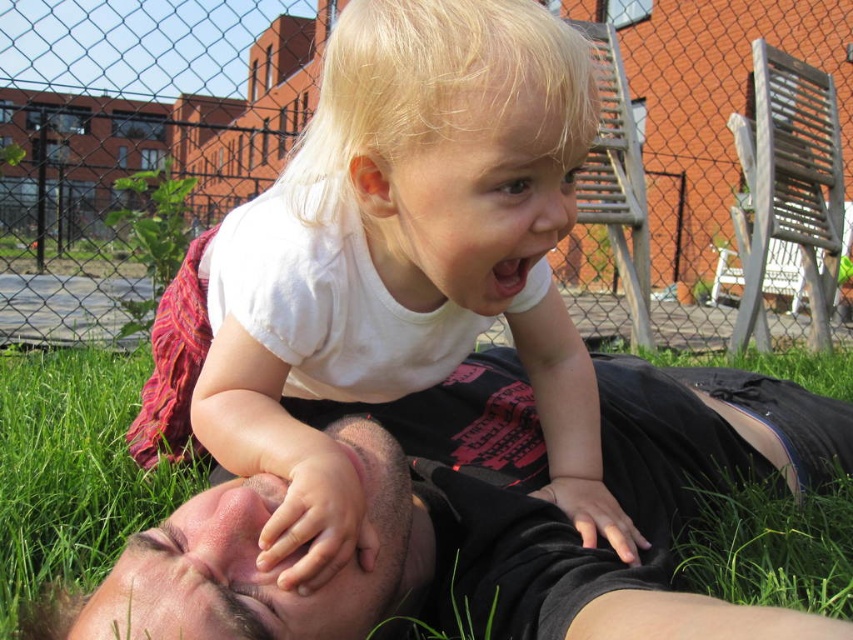
Who is more distant from viewer, (x=590, y=70) or (x=821, y=636)?

The point (x=590, y=70) is behind.

Which is behind, point (345, 557) or point (485, 577)?

Point (485, 577)

Identify the location of white matte/t-shirt at upper center. (405, 260).